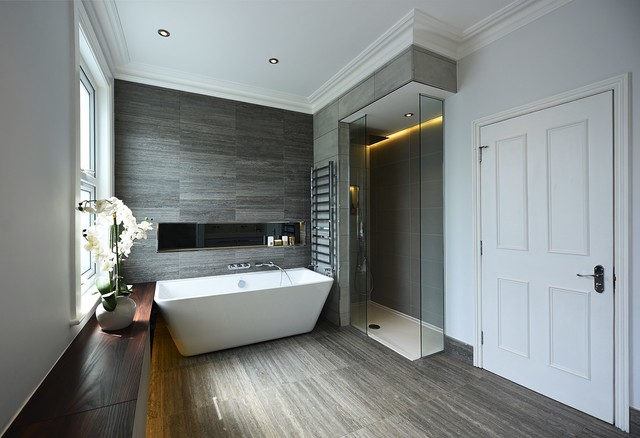
Locate an element on the screen. Image resolution: width=640 pixels, height=438 pixels. pot lights is located at coordinates (408, 116), (276, 62), (164, 35).